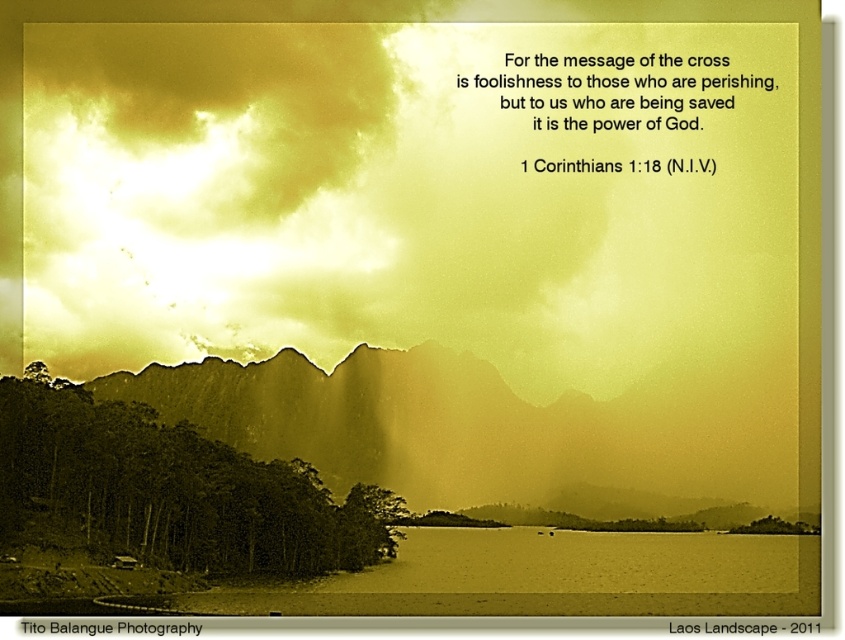
Question: Among these objects, which one is farthest from the camera?

Choices:
 (A) sepia textured mountain at center
 (B) green matte trees at lower left
 (C) golden textured sky at upper center

Answer: (C)

Question: Which object is positioned farthest from the golden textured sky at upper center?

Choices:
 (A) green matte trees at lower left
 (B) sepia textured mountain at center

Answer: (A)

Question: Does golden textured sky at upper center have a larger size compared to sepia textured mountain at center?

Choices:
 (A) no
 (B) yes

Answer: (B)

Question: Can you confirm if golden textured sky at upper center is positioned to the left of green matte trees at lower left?

Choices:
 (A) no
 (B) yes

Answer: (B)

Question: Considering the real-world distances, which object is closest to the sepia textured mountain at center?

Choices:
 (A) green matte trees at lower left
 (B) golden textured sky at upper center

Answer: (B)

Question: Does golden textured sky at upper center appear on the right side of sepia textured mountain at center?

Choices:
 (A) no
 (B) yes

Answer: (A)